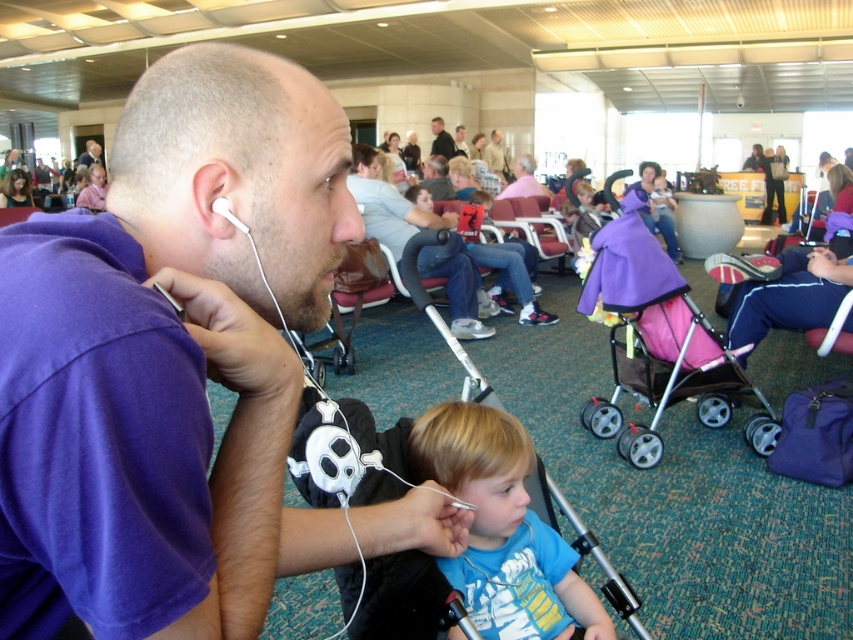
Question: Observing the image, what is the correct spatial positioning of matte black jacket at upper left in reference to smooth gray shirt at center?

Choices:
 (A) right
 (B) left

Answer: (B)

Question: Which point appears closest to the camera in this image?

Choices:
 (A) 500,154
 (B) 518,179

Answer: (B)

Question: Does purple cotton shirt at center have a larger size compared to light brown leather jacket at center?

Choices:
 (A) no
 (B) yes

Answer: (A)

Question: Which point appears farthest from the camera in this image?

Choices:
 (A) 496,170
 (B) 459,141
 (C) 497,196
 (D) 222,214

Answer: (B)

Question: Is matte gray shirt at center in front of light brown leather jacket at center?

Choices:
 (A) yes
 (B) no

Answer: (A)

Question: Among these objects, which one is farthest from the camera?

Choices:
 (A) light brown leather jacket at center
 (B) dark gray suit at center
 (C) matte black jacket at upper left
 (D) blue cotton shirt at center

Answer: (C)